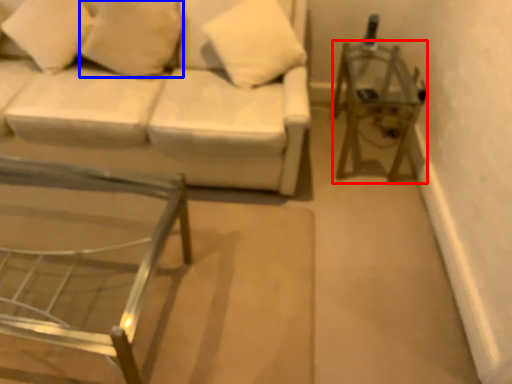
Question: Which point is further to the camera, side table (highlighted by a red box) or pillow (highlighted by a blue box)?

Choices:
 (A) side table
 (B) pillow

Answer: (A)